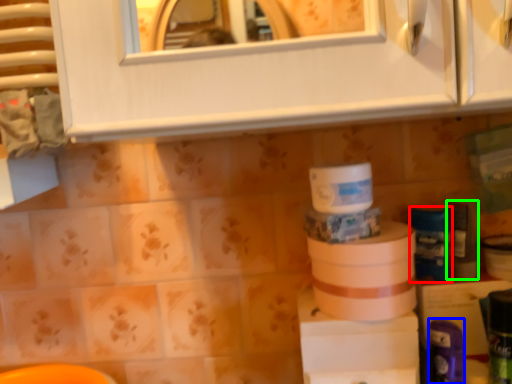
Question: Estimate the real-world distances between objects in this image. Which object is farther from toiletry (highlighted by a red box), toiletry (highlighted by a blue box) or toiletry (highlighted by a green box)?

Choices:
 (A) toiletry
 (B) toiletry

Answer: (A)